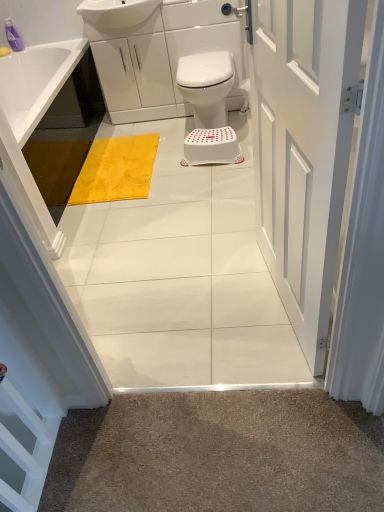
Question: From a real-world perspective, is white painted wood door at center above or below white plastic stool at center?

Choices:
 (A) below
 (B) above

Answer: (B)

Question: Considering the positions of white painted wood door at center and white plastic stool at center in the image, is white painted wood door at center bigger or smaller than white plastic stool at center?

Choices:
 (A) big
 (B) small

Answer: (A)

Question: Based on their relative distances, which object is nearer to the white painted wood door at center?

Choices:
 (A) white plastic stool at center
 (B) white glossy sink at upper center
 (C) translucent purple bottle at upper left
 (D) yellow plush bath mat at center
 (E) white plastic bidet at center

Answer: (A)

Question: Estimate the real-world distances between objects in this image. Which object is farther from the white plastic bidet at center?

Choices:
 (A) white plastic stool at center
 (B) white painted wood door at center
 (C) yellow plush bath mat at center
 (D) translucent purple bottle at upper left
 (E) white glossy sink at upper center

Answer: (D)